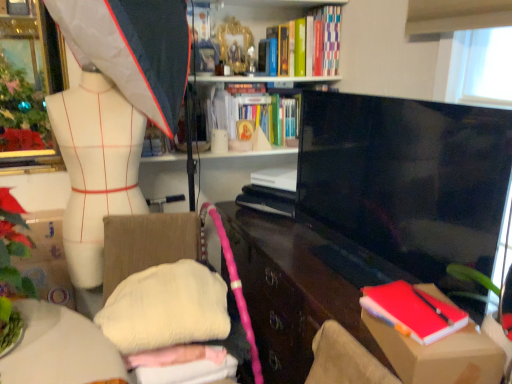
Question: Is white soft cushion at center outside of hardcover book at upper center, positioned as the third book in front-to-back order?

Choices:
 (A) no
 (B) yes

Answer: (B)

Question: From a real-world perspective, is white soft cushion at center positioned over hardcover book at upper center, which ranks as the 2th book in bottom-to-top order, based on gravity?

Choices:
 (A) yes
 (B) no

Answer: (B)

Question: Is white soft cushion at center wider than hardcover book at upper center, positioned as the 1th book in back-to-front order?

Choices:
 (A) no
 (B) yes

Answer: (B)

Question: Is white soft cushion at center further to the viewer compared to hardcover book at upper center, positioned as the 1th book in back-to-front order?

Choices:
 (A) no
 (B) yes

Answer: (A)

Question: Is white soft cushion at center positioned in front of hardcover book at upper center, positioned as the 1th book in back-to-front order?

Choices:
 (A) no
 (B) yes

Answer: (B)

Question: Is cardboard box at lower right bigger or smaller than white matte mannequin torso at left?

Choices:
 (A) big
 (B) small

Answer: (B)

Question: From the image's perspective, is cardboard box at lower right positioned above or below white matte mannequin torso at left?

Choices:
 (A) above
 (B) below

Answer: (B)

Question: Is cardboard box at lower right inside or outside of white matte mannequin torso at left?

Choices:
 (A) inside
 (B) outside

Answer: (B)

Question: From their relative heights in the image, would you say cardboard box at lower right is taller or shorter than white matte mannequin torso at left?

Choices:
 (A) short
 (B) tall

Answer: (A)

Question: Considering the relative positions of matte black cabinet at center and green leafy plant at left in the image provided, is matte black cabinet at center to the left or to the right of green leafy plant at left?

Choices:
 (A) right
 (B) left

Answer: (A)

Question: Looking at their shapes, would you say matte black cabinet at center is wider or thinner than green leafy plant at left?

Choices:
 (A) wide
 (B) thin

Answer: (A)

Question: From a real-world perspective, is matte black cabinet at center positioned above or below green leafy plant at left?

Choices:
 (A) below
 (B) above

Answer: (A)

Question: From the image's perspective, is matte black cabinet at center above or below green leafy plant at left?

Choices:
 (A) below
 (B) above

Answer: (A)

Question: Considering their positions, is green matte book at upper center, the 3th book when ordered from bottom to top, located in front of or behind white matte mannequin torso at left?

Choices:
 (A) behind
 (B) front

Answer: (A)

Question: In terms of size, does green matte book at upper center, the 3th book when ordered from bottom to top, appear bigger or smaller than white matte mannequin torso at left?

Choices:
 (A) small
 (B) big

Answer: (A)